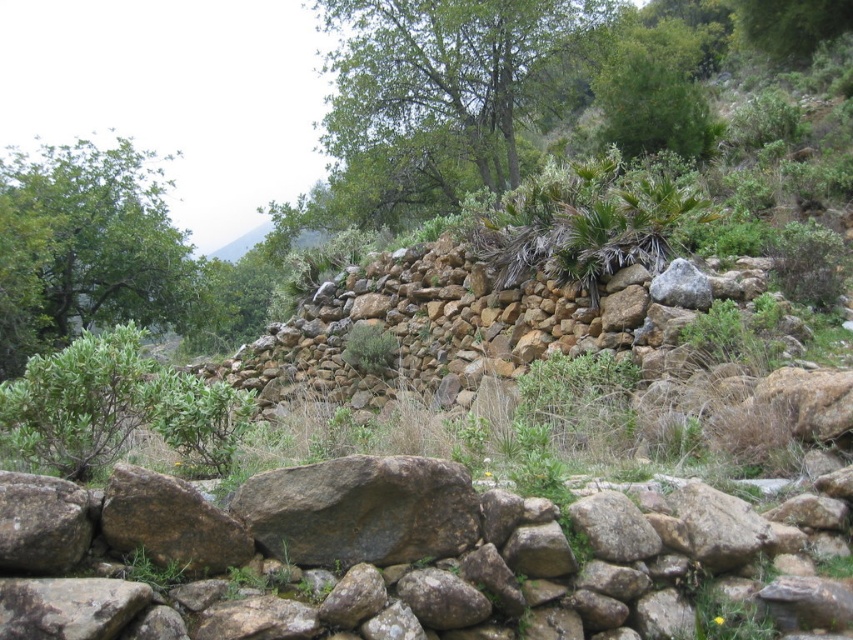
Can you confirm if green leafy tree at upper left is smaller than gray rough rock at center?

No, green leafy tree at upper left is not smaller than gray rough rock at center.

Can you confirm if green leafy tree at upper left is thinner than gray rough rock at center?

No, green leafy tree at upper left is not thinner than gray rough rock at center.

Between point (115, 252) and point (407, 502), which one is positioned behind?

The point (115, 252) is behind.

Locate an element on the screen. green leafy tree at upper left is located at coordinates (90, 248).

Does green leafy tree at upper center have a smaller size compared to gray rough rock at center?

Actually, green leafy tree at upper center might be larger than gray rough rock at center.

Who is more forward, (364, 144) or (241, 490)?

Positioned in front is point (241, 490).

Where is `green leafy tree at upper center`? The image size is (853, 640). green leafy tree at upper center is located at coordinates (436, 97).

Between rusty stone wall at center and green leafy bush at lower left, which one has more height?

With more height is green leafy bush at lower left.

Can you confirm if rusty stone wall at center is shorter than green leafy bush at lower left?

Correct, rusty stone wall at center is not as tall as green leafy bush at lower left.

Image resolution: width=853 pixels, height=640 pixels. Describe the element at coordinates (363, 556) in the screenshot. I see `rusty stone wall at center` at that location.

Identify the location of rusty stone wall at center. The image size is (853, 640). (363, 556).